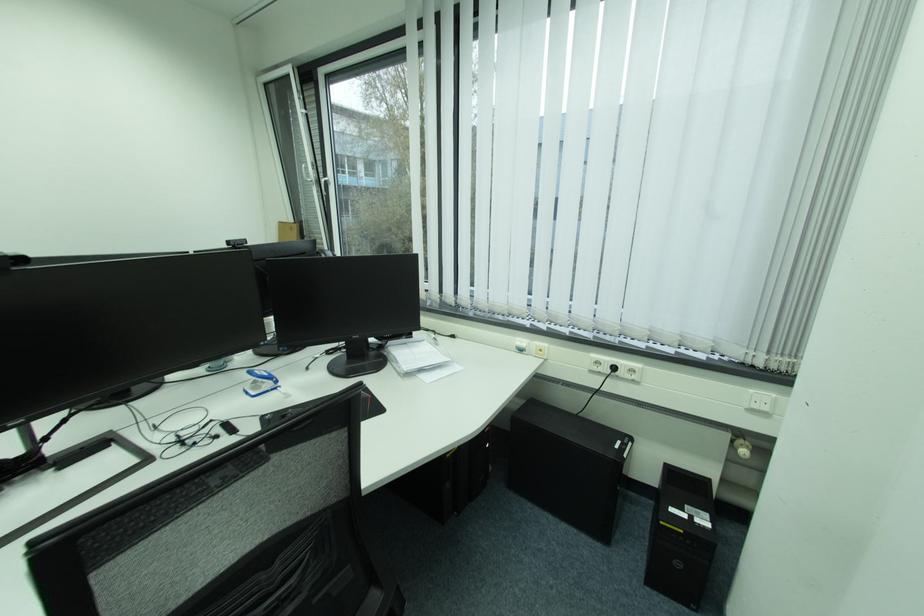
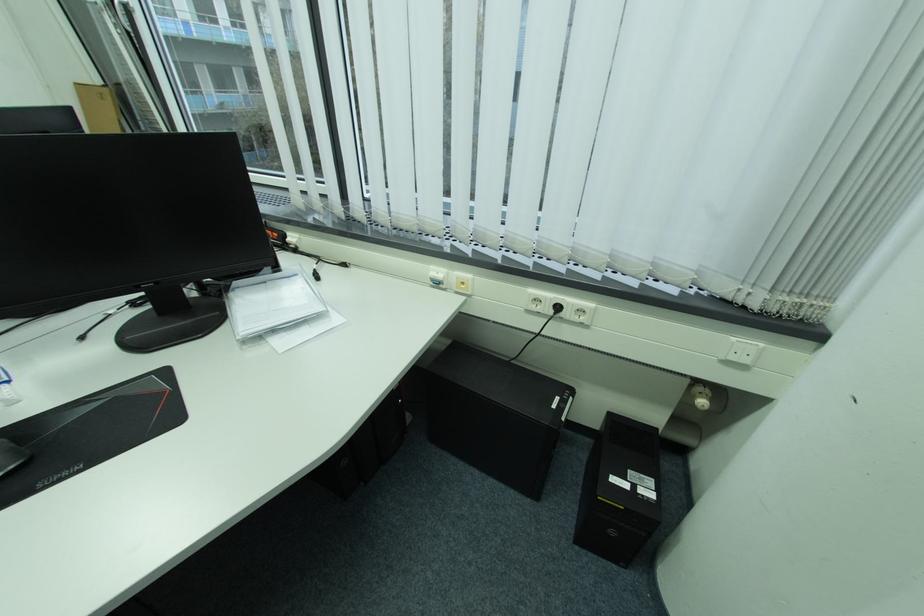
Question: Based on the continuous images, in which direction is the camera rotating? Reply with the corresponding letter.

Choices:
 (A) Left
 (B) Right
 (C) Up
 (D) Down

Answer: (D)